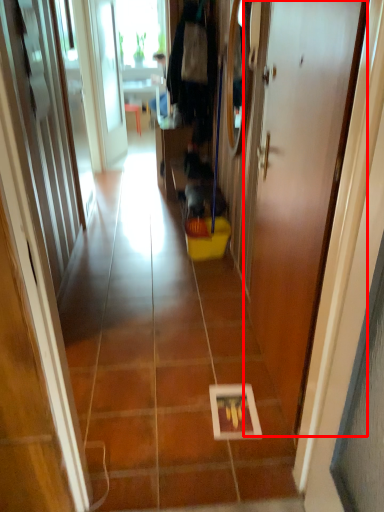
Question: Considering the relative positions of door (annotated by the red box) and path in the image provided, where is door (annotated by the red box) located with respect to the staircase?

Choices:
 (A) right
 (B) left

Answer: (A)